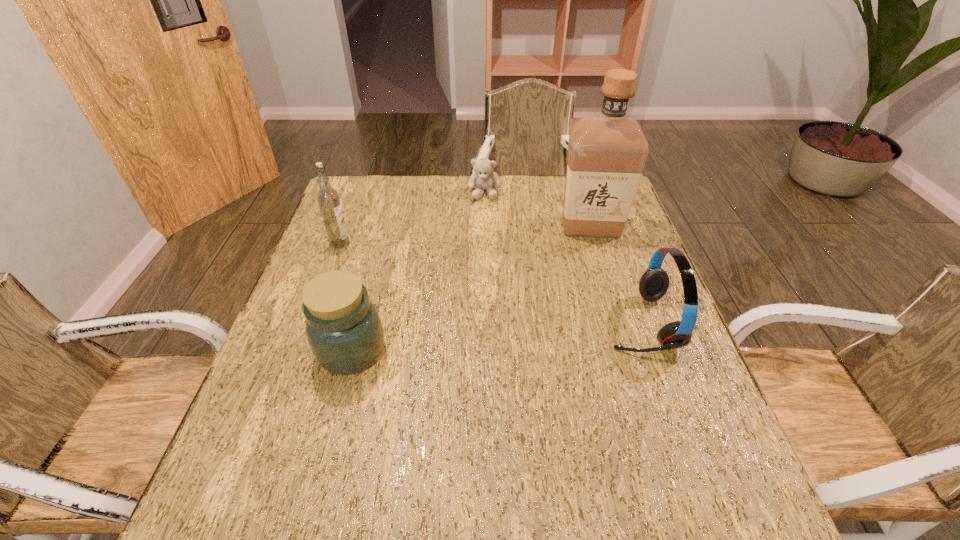
At what (x,y) coordinates should I click in order to perform the action: click on vacant space at the right edge of the desktop. Please return your answer as a coordinate pair (x, y). The width and height of the screenshot is (960, 540). Looking at the image, I should click on (644, 404).

Find the location of `vacant space at the far left corner of the desktop`. vacant space at the far left corner of the desktop is located at coordinates (368, 187).

At what (x,y) coordinates should I click in order to perform the action: click on free area in between the liquor and the vodka. Please return your answer as a coordinate pair (x, y). Looking at the image, I should click on (466, 235).

This screenshot has height=540, width=960. What are the coordinates of `free space between the liquor and the vodka` in the screenshot? It's located at (466, 235).

Find the location of a particular element. Image resolution: width=960 pixels, height=540 pixels. free space between the liquor and the fourth object from right to left is located at coordinates (471, 289).

Locate an element on the screen. empty space between the jar and the farthest object is located at coordinates (419, 271).

Identify the location of free space between the jar and the headset. Image resolution: width=960 pixels, height=540 pixels. (495, 336).

Locate an element on the screen. This screenshot has height=540, width=960. vacant space that's between the jar and the headset is located at coordinates (495, 336).

Identify the location of free space between the headset and the second object from left to right. Image resolution: width=960 pixels, height=540 pixels. (495, 336).

In order to click on vacant space in between the headset and the farthest object in this screenshot , I will do [x=563, y=257].